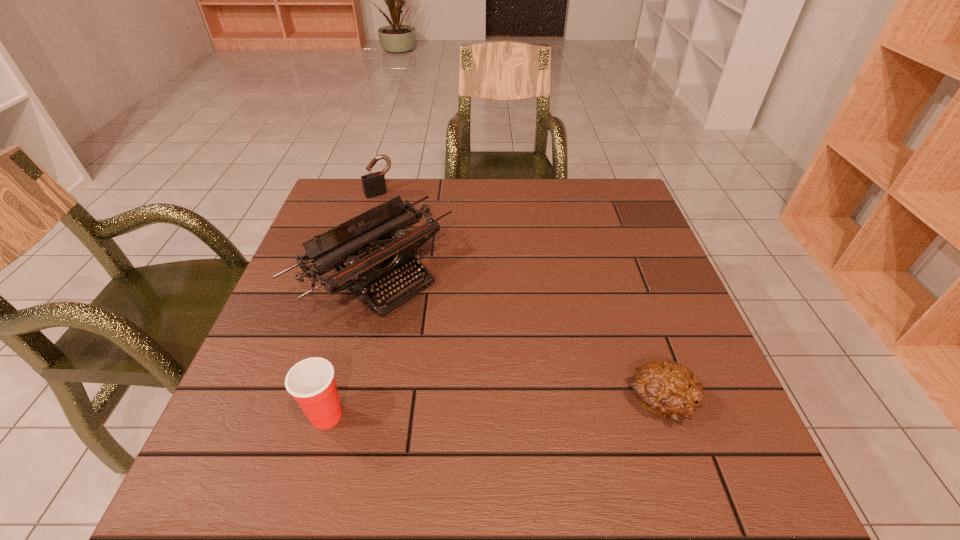
Identify the location of vacant space on the desktop that is between the Dixie cup and the muffin and is positioned on the typing side of the second farthest object. The image size is (960, 540). (540, 408).

In order to click on free spot on the desktop that is between the Dixie cup and the rightmost object and is positioned with the keyhole on the front of the farthest object in this screenshot , I will do `click(530, 408)`.